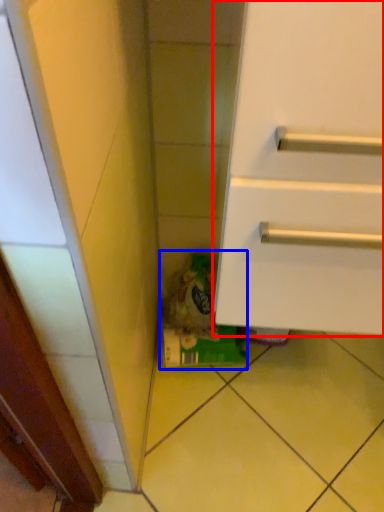
Question: Which object is closer to the camera taking this photo, cabinetry (highlighted by a red box) or garbage (highlighted by a blue box)?

Choices:
 (A) cabinetry
 (B) garbage

Answer: (A)